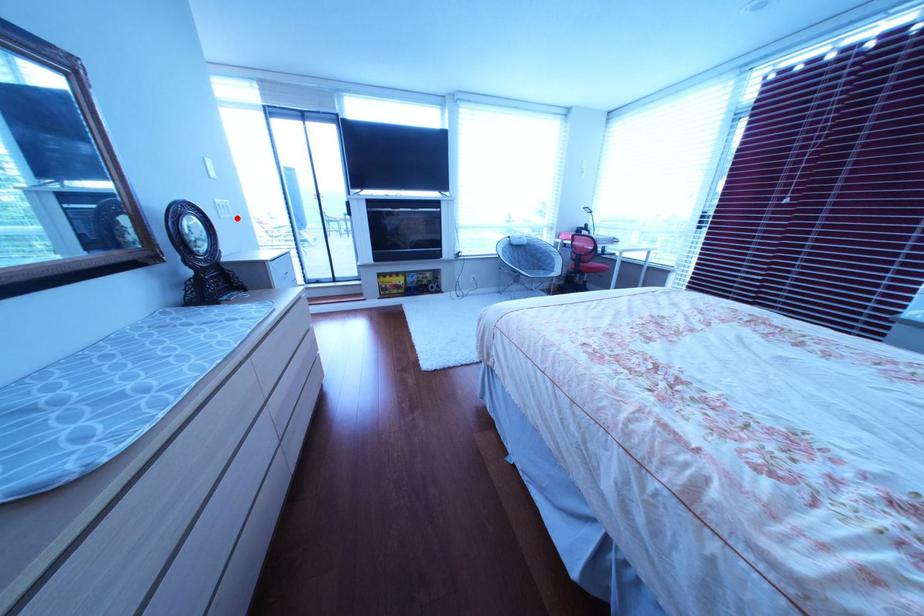
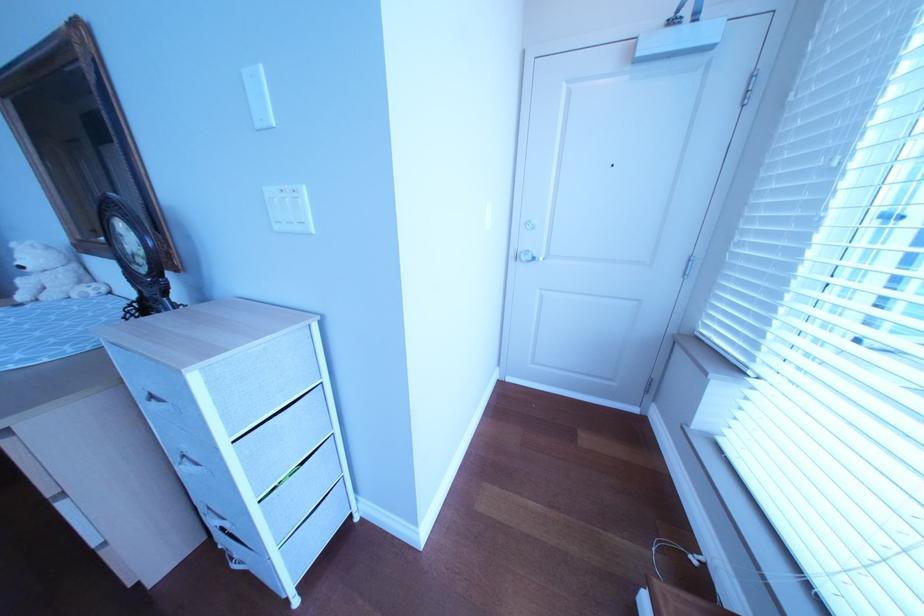
Question: I am providing you with two images of the same scene from different viewpoints. A red point is marked on the first image. At the location where the point appears in image 1, is it still visible in image 2?

Choices:
 (A) Yes
 (B) No

Answer: (A)